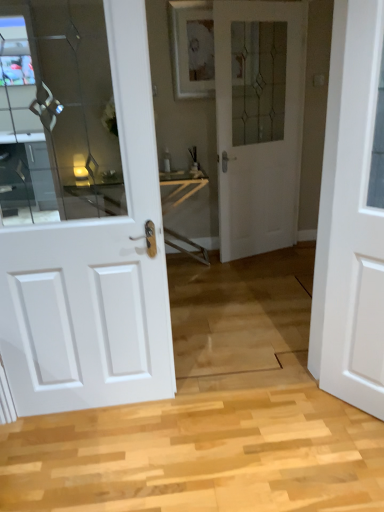
Image resolution: width=384 pixels, height=512 pixels. I want to click on free space to the left of white matte door at right, marked as the first door in a right-to-left arrangement, so click(x=305, y=416).